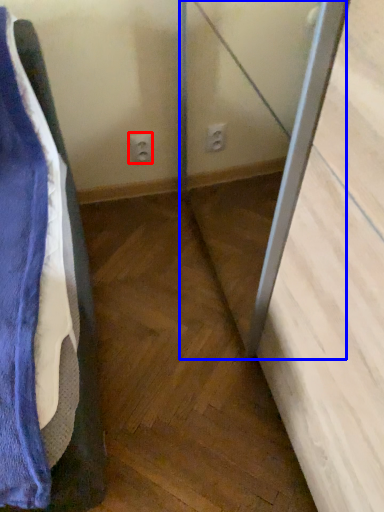
Question: Among these objects, which one is farthest to the camera, electric outlet (highlighted by a red box) or screen door (highlighted by a blue box)?

Choices:
 (A) electric outlet
 (B) screen door

Answer: (A)